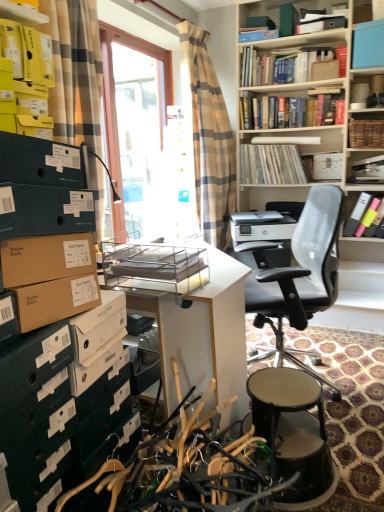
At what (x,y) coordinates should I click in order to perform the action: click on free space above hardcover book at upper center, arranged as the first book when viewed from the top (from a real-world perspective). Please return your answer as a coordinate pair (x, y). This screenshot has height=512, width=384. Looking at the image, I should click on (291, 41).